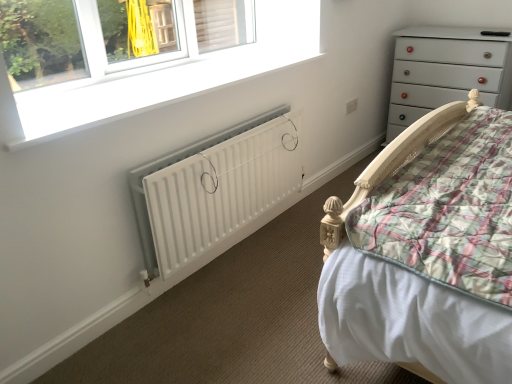
Describe the element at coordinates (163, 72) in the screenshot. I see `white matte window at upper left` at that location.

This screenshot has height=384, width=512. I want to click on white matte radiator at lower center, so click(x=214, y=188).

This screenshot has width=512, height=384. Describe the element at coordinates (447, 69) in the screenshot. I see `white glossy chest of drawers at upper right` at that location.

Where is `white matte window at upper left`? The height and width of the screenshot is (384, 512). white matte window at upper left is located at coordinates (163, 72).

From their relative heights in the image, would you say white glossy chest of drawers at upper right is taller or shorter than white matte window at upper left?

white glossy chest of drawers at upper right is taller than white matte window at upper left.

Does white glossy chest of drawers at upper right appear on the right side of white matte window at upper left?

Correct, you'll find white glossy chest of drawers at upper right to the right of white matte window at upper left.

From the image's perspective, does white glossy chest of drawers at upper right appear higher than white matte window at upper left?

Yes, from the image's perspective, white glossy chest of drawers at upper right is on top of white matte window at upper left.

How much distance is there between white matte radiator at lower center and white glossy chest of drawers at upper right?

They are 1.59 meters apart.

Can white glossy chest of drawers at upper right be found inside white matte radiator at lower center?

No, white glossy chest of drawers at upper right is not inside white matte radiator at lower center.

Considering the sizes of objects white matte radiator at lower center and white glossy chest of drawers at upper right in the image provided, who is bigger, white matte radiator at lower center or white glossy chest of drawers at upper right?

Bigger between the two is white glossy chest of drawers at upper right.

Considering the points (260, 130) and (462, 85), which point is in front, point (260, 130) or point (462, 85)?

The point (260, 130) is in front.

Considering the sizes of objects white matte window at upper left and white matte radiator at lower center in the image provided, who is thinner, white matte window at upper left or white matte radiator at lower center?

Thinner between the two is white matte radiator at lower center.

Is white matte window at upper left to the left of white matte radiator at lower center from the viewer's perspective?

Yes, white matte window at upper left is to the left of white matte radiator at lower center.

Is white glossy chest of drawers at upper right turned away from white matte radiator at lower center?

No.

Does white glossy chest of drawers at upper right have a greater width compared to white matte radiator at lower center?

Yes.

Can you confirm if white glossy chest of drawers at upper right is smaller than white matte radiator at lower center?

No.

Is there a large distance between white glossy chest of drawers at upper right and white matte radiator at lower center?

white glossy chest of drawers at upper right is positioned a significant distance from white matte radiator at lower center.

Is white matte window at upper left oriented towards white glossy chest of drawers at upper right?

No, white matte window at upper left is not oriented towards white glossy chest of drawers at upper right.

From the image's perspective, which is above, white matte window at upper left or white glossy chest of drawers at upper right?

white glossy chest of drawers at upper right, from the image's perspective.

Identify the location of window on the left of white glossy chest of drawers at upper right. (163, 72).

Does point (312, 57) lie behind point (470, 59)?

No, it is in front of (470, 59).

Looking at this image, can you confirm if white matte radiator at lower center is smaller than white matte window at upper left?

No.

Measure the distance between white matte radiator at lower center and white matte window at upper left.

They are 17.72 inches apart.

Find the location of `radiator below the white matte window at upper left (from the image's perspective)`. radiator below the white matte window at upper left (from the image's perspective) is located at coordinates (214, 188).

Which object is wider, white matte radiator at lower center or white matte window at upper left?

With larger width is white matte window at upper left.

At what (x,y) coordinates should I click in order to perform the action: click on window that appears above the white glossy chest of drawers at upper right (from a real-world perspective). Please return your answer as a coordinate pair (x, y). Looking at the image, I should click on (163, 72).

The height and width of the screenshot is (384, 512). I want to click on radiator that appears below the white glossy chest of drawers at upper right (from the image's perspective), so click(x=214, y=188).

Which object lies further to the anchor point white matte window at upper left, white glossy chest of drawers at upper right or white matte radiator at lower center?

Among the two, white glossy chest of drawers at upper right is located further to white matte window at upper left.

Looking at the image, which one is located closer to white matte radiator at lower center, white glossy chest of drawers at upper right or white matte window at upper left?

white matte window at upper left.

Which object lies further to the anchor point white matte window at upper left, white matte radiator at lower center or white glossy chest of drawers at upper right?

Among the two, white glossy chest of drawers at upper right is located further to white matte window at upper left.

Which object lies nearer to the anchor point white matte radiator at lower center, white matte window at upper left or white glossy chest of drawers at upper right?

The object closer to white matte radiator at lower center is white matte window at upper left.

When comparing their distances from white glossy chest of drawers at upper right, does white matte window at upper left or white matte radiator at lower center seem closer?

Among the two, white matte window at upper left is located nearer to white glossy chest of drawers at upper right.

Estimate the real-world distances between objects in this image. Which object is further from white glossy chest of drawers at upper right, white matte radiator at lower center or white matte window at upper left?

white matte radiator at lower center is further to white glossy chest of drawers at upper right.

Locate an element on the screen. This screenshot has width=512, height=384. radiator between white matte window at upper left and white glossy chest of drawers at upper right from left to right is located at coordinates (214, 188).